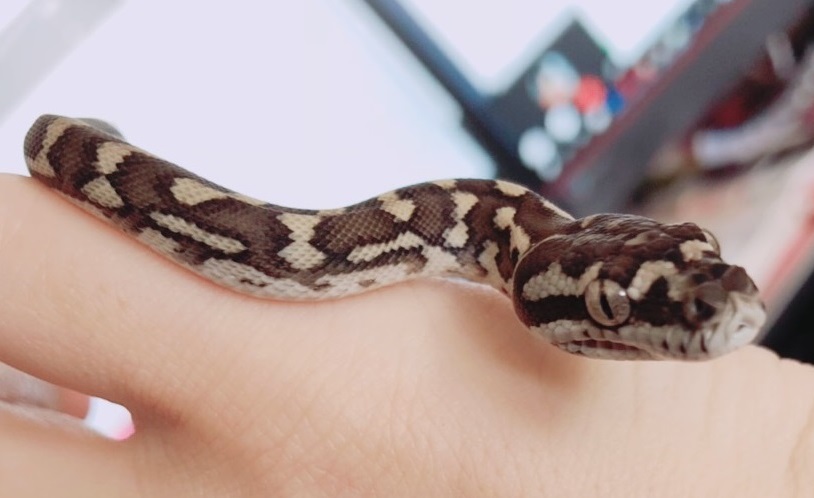
Where is `left edge of computer screen`? left edge of computer screen is located at coordinates (378, 14), (449, 94).